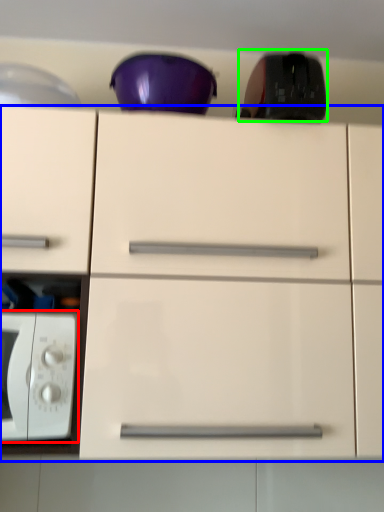
Question: Considering the real-world distances, which object is farthest from microwave oven (highlighted by a red box)? cabinetry (highlighted by a blue box) or appliance (highlighted by a green box)?

Choices:
 (A) cabinetry
 (B) appliance

Answer: (B)